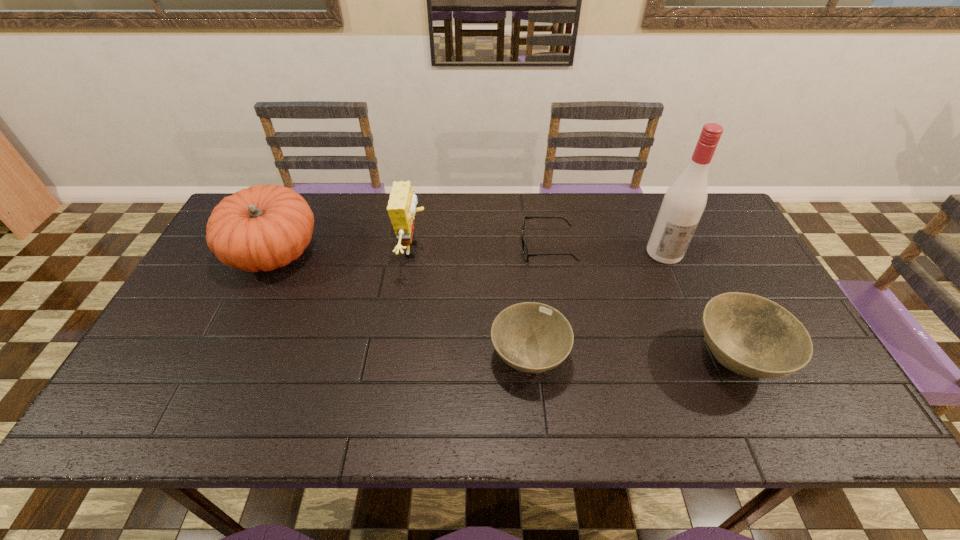
In the current image, all bowls are evenly spaced. To maintain this equal spacing, where should an additional bowl be placed on the left? Please point out a free spot. Please provide its 2D coordinates. Your answer should be formatted as a tuple, i.e. [(x, y)], where the tuple contains the x and y coordinates of a point satisfying the conditions above.

[(324, 357)]